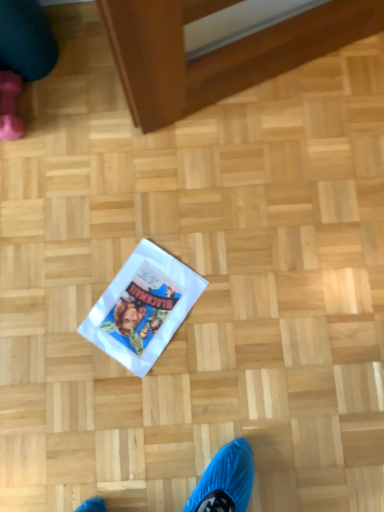
Question: Which is correct: white paper flyer at center is inside pink rubber boot at upper left, or outside of it?

Choices:
 (A) inside
 (B) outside

Answer: (B)

Question: Looking at the image, does white paper flyer at center seem bigger or smaller compared to pink rubber boot at upper left?

Choices:
 (A) big
 (B) small

Answer: (A)

Question: Estimate the real-world distances between objects in this image. Which object is closer to the teal fabric leg at upper left?

Choices:
 (A) pink rubber boot at upper left
 (B) white paper flyer at center

Answer: (A)

Question: Which object is positioned farthest from the white paper flyer at center?

Choices:
 (A) teal fabric leg at upper left
 (B) pink rubber boot at upper left

Answer: (A)